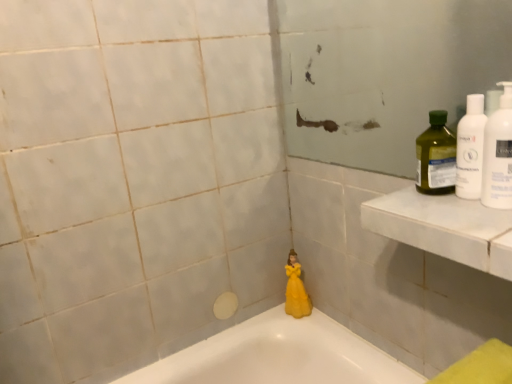
Question: From the image's perspective, does white marble ledge at upper right appear higher than yellow matte figurine at center?

Choices:
 (A) no
 (B) yes

Answer: (B)

Question: Is white marble ledge at upper right in contact with yellow matte figurine at center?

Choices:
 (A) yes
 (B) no

Answer: (B)

Question: Is white marble ledge at upper right not near yellow matte figurine at center?

Choices:
 (A) no
 (B) yes

Answer: (A)

Question: From the image's perspective, would you say white marble ledge at upper right is shown under yellow matte figurine at center?

Choices:
 (A) yes
 (B) no

Answer: (B)

Question: Is yellow matte figurine at center completely or partially inside white marble ledge at upper right?

Choices:
 (A) yes
 (B) no

Answer: (B)

Question: In terms of height, does green plastic bottle at upper right, the first cleaning product positioned from the back, look taller or shorter compared to white marble ledge at upper right?

Choices:
 (A) tall
 (B) short

Answer: (A)

Question: From the image's perspective, is green plastic bottle at upper right, the third cleaning product viewed from the front, above or below white marble ledge at upper right?

Choices:
 (A) above
 (B) below

Answer: (A)

Question: Is green plastic bottle at upper right, the first cleaning product positioned from the back, in front of or behind white marble ledge at upper right in the image?

Choices:
 (A) behind
 (B) front

Answer: (A)

Question: Is point (433, 165) positioned closer to the camera than point (487, 269)?

Choices:
 (A) farther
 (B) closer

Answer: (A)

Question: Based on their positions, is white plastic bottle at upper right, the second cleaning product viewed from the front, located to the left or right of white plastic bottle at upper right, the 3th cleaning product in the back-to-front sequence?

Choices:
 (A) right
 (B) left

Answer: (B)

Question: In terms of width, does white plastic bottle at upper right, the 2th cleaning product when ordered from back to front, look wider or thinner when compared to white plastic bottle at upper right, the first cleaning product in the front-to-back sequence?

Choices:
 (A) wide
 (B) thin

Answer: (B)

Question: Is white plastic bottle at upper right, the 2th cleaning product when ordered from back to front, inside or outside of white plastic bottle at upper right, the first cleaning product in the front-to-back sequence?

Choices:
 (A) outside
 (B) inside

Answer: (A)

Question: In terms of height, does white plastic bottle at upper right, the 2th cleaning product when ordered from back to front, look taller or shorter compared to white plastic bottle at upper right, the first cleaning product in the front-to-back sequence?

Choices:
 (A) tall
 (B) short

Answer: (B)

Question: From a real-world perspective, is white plastic bottle at upper right, the 2th cleaning product when ordered from back to front, positioned above or below green plastic bottle at upper right, the first cleaning product positioned from the back?

Choices:
 (A) above
 (B) below

Answer: (A)

Question: Would you say white plastic bottle at upper right, the second cleaning product viewed from the front, is to the left or to the right of green plastic bottle at upper right, the first cleaning product positioned from the back, in the picture?

Choices:
 (A) left
 (B) right

Answer: (B)